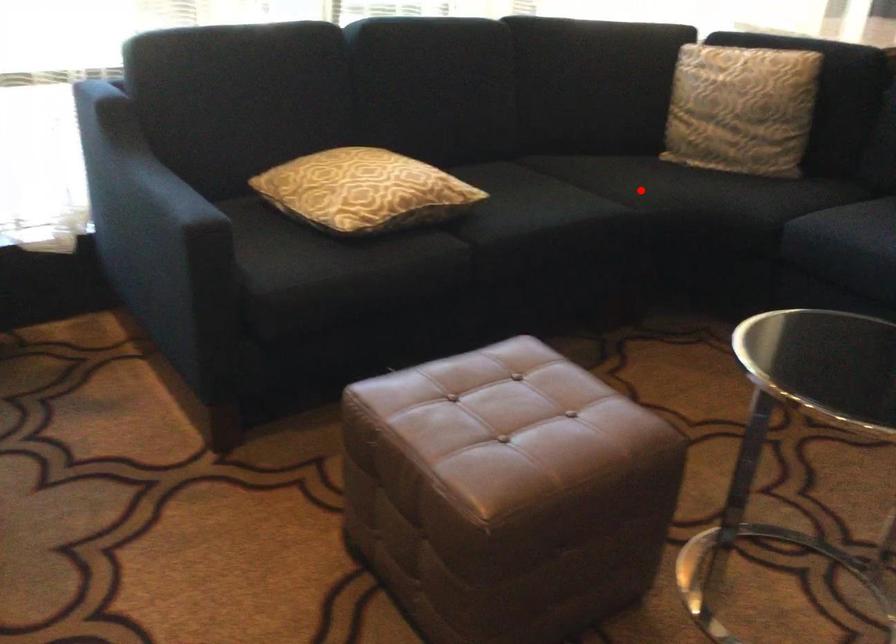
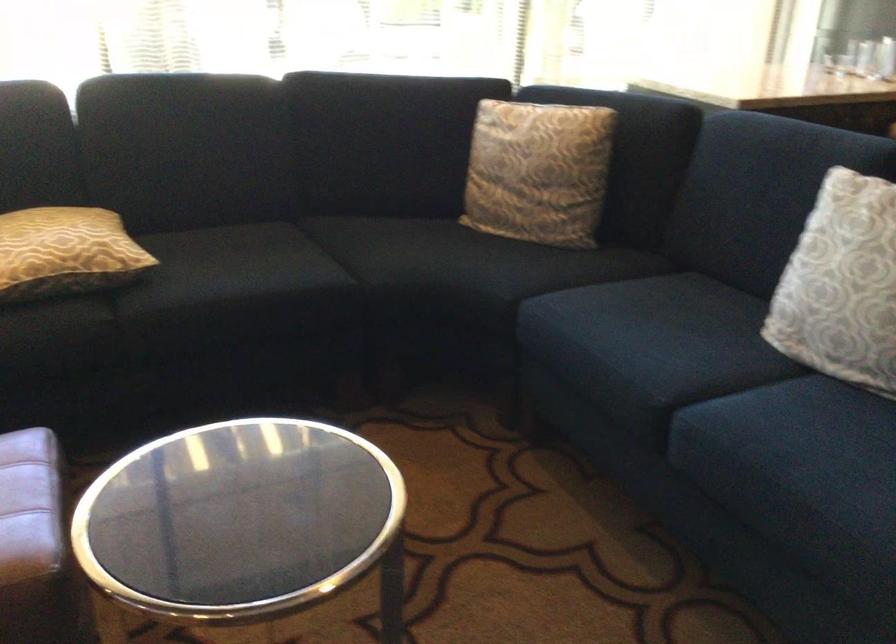
Where in the second image is the point corresponding to the highlighted location from the first image?

(391, 261)